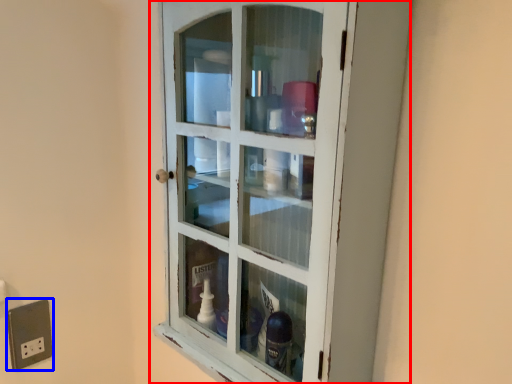
Question: Which object is further to the camera taking this photo, cupboard (highlighted by a red box) or electric outlet (highlighted by a blue box)?

Choices:
 (A) cupboard
 (B) electric outlet

Answer: (B)